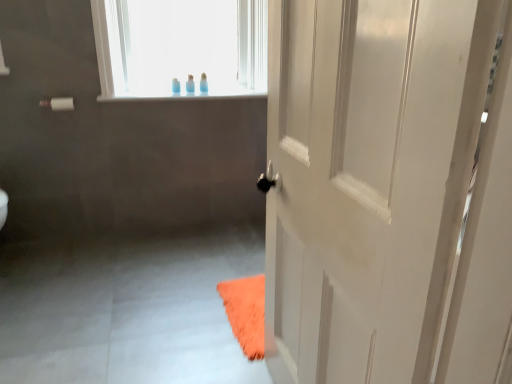
How much space does translucent plastic toothbrush at upper center, the second toiletry in the left-to-right sequence, occupy horizontally?

translucent plastic toothbrush at upper center, the second toiletry in the left-to-right sequence, is 5.92 centimeters wide.

What do you see at coordinates (372, 177) in the screenshot?
I see `white glossy door at right` at bounding box center [372, 177].

The image size is (512, 384). In order to click on translucent plastic bottle at upper center, marked as the second toiletry in a right-to-left arrangement in this screenshot , I will do `click(176, 86)`.

The width and height of the screenshot is (512, 384). I want to click on white matte towel bar at upper left, so click(x=58, y=104).

Are translucent plastic bottle at upper center, marked as the second toiletry in a right-to-left arrangement, and translucent plastic toothbrush at upper center, which is the first toiletry from right to left, located far from each other?

No, there isn't a large distance between translucent plastic bottle at upper center, marked as the second toiletry in a right-to-left arrangement, and translucent plastic toothbrush at upper center, which is the first toiletry from right to left.

Does translucent plastic bottle at upper center, the 1th toiletry from the left, have a greater width compared to translucent plastic toothbrush at upper center, which is the first toiletry from right to left?

Yes.

Considering the points (174, 84) and (191, 77), which point is behind, point (174, 84) or point (191, 77)?

Point (191, 77)

Does translucent plastic bottle at upper center, the 1th toiletry from the left, lie in front of translucent plastic toothbrush at upper center, which is the first toiletry from right to left?

Yes, translucent plastic bottle at upper center, the 1th toiletry from the left, is closer to the viewer.

Is white glossy door at right positioned in front of translucent plastic toothbrush at upper center, the second toiletry in the left-to-right sequence?

Yes, it is in front of translucent plastic toothbrush at upper center, the second toiletry in the left-to-right sequence.

Is white glossy door at right smaller than translucent plastic toothbrush at upper center, which is the first toiletry from right to left?

No.

Which is less distant, (371, 186) or (187, 83)?

Point (371, 186) is positioned closer to the camera compared to point (187, 83).

From the picture: Would you say translucent plastic toothbrush at upper center, which is the first toiletry from right to left, is part of white glossy door at right's contents?

No, white glossy door at right does not contain translucent plastic toothbrush at upper center, which is the first toiletry from right to left.

Is translucent plastic bottle at upper center, the 1th toiletry from the left, located outside white matte towel bar at upper left?

Yes, translucent plastic bottle at upper center, the 1th toiletry from the left, is located beyond the bounds of white matte towel bar at upper left.

Does point (177, 90) come behind point (53, 106)?

Yes, it is.

Is translucent plastic bottle at upper center, the 1th toiletry from the left, oriented towards white matte towel bar at upper left?

No, translucent plastic bottle at upper center, the 1th toiletry from the left, is not facing towards white matte towel bar at upper left.

Looking at their sizes, would you say translucent plastic bottle at upper center, marked as the second toiletry in a right-to-left arrangement, is wider or thinner than white matte towel bar at upper left?

In the image, translucent plastic bottle at upper center, marked as the second toiletry in a right-to-left arrangement, appears to be more narrow than white matte towel bar at upper left.

Does white matte towel bar at upper left appear on the right side of translucent plastic toothbrush at upper center, which is the first toiletry from right to left?

No.

Is white matte towel bar at upper left aimed at translucent plastic toothbrush at upper center, the second toiletry in the left-to-right sequence?

No, white matte towel bar at upper left is not facing towards translucent plastic toothbrush at upper center, the second toiletry in the left-to-right sequence.

From the image's perspective, is white matte towel bar at upper left beneath translucent plastic toothbrush at upper center, the second toiletry in the left-to-right sequence?

Correct, white matte towel bar at upper left appears lower than translucent plastic toothbrush at upper center, the second toiletry in the left-to-right sequence, in the image.

Based on their sizes in the image, would you say translucent plastic toothbrush at upper center, which is the first toiletry from right to left, is bigger or smaller than white glossy door at right?

Clearly, translucent plastic toothbrush at upper center, which is the first toiletry from right to left, is smaller in size than white glossy door at right.

Does translucent plastic toothbrush at upper center, which is the first toiletry from right to left, have a lesser width compared to white glossy door at right?

Indeed, translucent plastic toothbrush at upper center, which is the first toiletry from right to left, has a lesser width compared to white glossy door at right.

Considering the sizes of translucent plastic toothbrush at upper center, the second toiletry in the left-to-right sequence, and white glossy door at right in the image, is translucent plastic toothbrush at upper center, the second toiletry in the left-to-right sequence, taller or shorter than white glossy door at right?

translucent plastic toothbrush at upper center, the second toiletry in the left-to-right sequence, is shorter than white glossy door at right.

Could you measure the distance between translucent plastic toothbrush at upper center, which is the first toiletry from right to left, and white glossy door at right?

The distance of translucent plastic toothbrush at upper center, which is the first toiletry from right to left, from white glossy door at right is 1.86 meters.

Is white matte towel bar at upper left positioned far away from translucent plastic bottle at upper center, the 1th toiletry from the left?

white matte towel bar at upper left is near translucent plastic bottle at upper center, the 1th toiletry from the left, not far away.

Considering the relative sizes of white matte towel bar at upper left and translucent plastic bottle at upper center, marked as the second toiletry in a right-to-left arrangement, in the image provided, is white matte towel bar at upper left taller than translucent plastic bottle at upper center, marked as the second toiletry in a right-to-left arrangement,?

No, white matte towel bar at upper left is not taller than translucent plastic bottle at upper center, marked as the second toiletry in a right-to-left arrangement.

From a real-world perspective, does white matte towel bar at upper left sit lower than translucent plastic bottle at upper center, the 1th toiletry from the left?

Correct, in the physical world, white matte towel bar at upper left is lower than translucent plastic bottle at upper center, the 1th toiletry from the left.

Is white matte towel bar at upper left thinner than translucent plastic bottle at upper center, the 1th toiletry from the left?

No, white matte towel bar at upper left is not thinner than translucent plastic bottle at upper center, the 1th toiletry from the left.

Which is farther from the camera, (64, 107) or (350, 190)?

Positioned behind is point (64, 107).

In the scene shown: Between white matte towel bar at upper left and white glossy door at right, which one has more height?

Standing taller between the two is white glossy door at right.

Does white matte towel bar at upper left appear on the right side of white glossy door at right?

In fact, white matte towel bar at upper left is to the left of white glossy door at right.

How different are the orientations of white matte towel bar at upper left and white glossy door at right in degrees?

The angle between the facing direction of white matte towel bar at upper left and the facing direction of white glossy door at right is 90 degrees.

Image resolution: width=512 pixels, height=384 pixels. In order to click on toiletry that is below the translucent plastic toothbrush at upper center, which is the first toiletry from right to left (from the image's perspective) in this screenshot , I will do `click(176, 86)`.

Image resolution: width=512 pixels, height=384 pixels. Identify the location of door to the right of translucent plastic toothbrush at upper center, which is the first toiletry from right to left. (372, 177).

When comparing their distances from white matte towel bar at upper left, does white glossy door at right or translucent plastic toothbrush at upper center, the second toiletry in the left-to-right sequence, seem closer?

translucent plastic toothbrush at upper center, the second toiletry in the left-to-right sequence, lies closer to white matte towel bar at upper left than the other object.

Which object lies further to the anchor point white matte towel bar at upper left, translucent plastic bottle at upper center, marked as the second toiletry in a right-to-left arrangement, or white glossy door at right?

white glossy door at right lies further to white matte towel bar at upper left than the other object.

When comparing their distances from white matte towel bar at upper left, does translucent plastic bottle at upper center, marked as the second toiletry in a right-to-left arrangement, or translucent plastic toothbrush at upper center, which is the first toiletry from right to left, seem closer?

The object closer to white matte towel bar at upper left is translucent plastic bottle at upper center, marked as the second toiletry in a right-to-left arrangement.

Considering their positions, is white matte towel bar at upper left positioned further to white glossy door at right than translucent plastic bottle at upper center, the 1th toiletry from the left?

The object further to white glossy door at right is white matte towel bar at upper left.

Which object lies nearer to the anchor point translucent plastic bottle at upper center, marked as the second toiletry in a right-to-left arrangement, translucent plastic toothbrush at upper center, the second toiletry in the left-to-right sequence, or white matte towel bar at upper left?

The object closer to translucent plastic bottle at upper center, marked as the second toiletry in a right-to-left arrangement, is translucent plastic toothbrush at upper center, the second toiletry in the left-to-right sequence.

From the image, which object appears to be nearer to translucent plastic bottle at upper center, the 1th toiletry from the left, translucent plastic toothbrush at upper center, the second toiletry in the left-to-right sequence, or white glossy door at right?

translucent plastic toothbrush at upper center, the second toiletry in the left-to-right sequence.

Based on their spatial positions, is white glossy door at right or translucent plastic bottle at upper center, marked as the second toiletry in a right-to-left arrangement, further from translucent plastic toothbrush at upper center, the second toiletry in the left-to-right sequence?

Among the two, white glossy door at right is located further to translucent plastic toothbrush at upper center, the second toiletry in the left-to-right sequence.

From the image, which object appears to be nearer to translucent plastic toothbrush at upper center, which is the first toiletry from right to left, white glossy door at right or white matte towel bar at upper left?

Based on the image, white matte towel bar at upper left appears to be nearer to translucent plastic toothbrush at upper center, which is the first toiletry from right to left.

You are a GUI agent. You are given a task and a screenshot of the screen. Output one action in this format:
    pyautogui.click(x=<x>, y=<y>)
    Task: Click on the toiletry between white matte towel bar at upper left and translucent plastic toothbrush at upper center, which is the first toiletry from right to left
    
    Given the screenshot: What is the action you would take?
    pyautogui.click(x=176, y=86)

I want to click on toiletry between white glossy door at right and translucent plastic toothbrush at upper center, the second toiletry in the left-to-right sequence, from front to back, so [x=176, y=86].